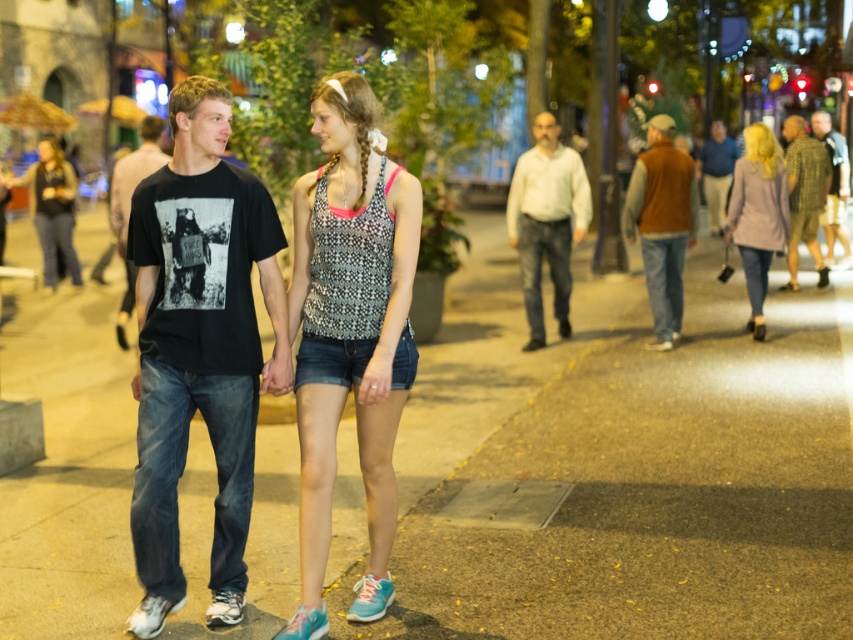
Question: Which object is the farthest from the brown concrete pavement at center?

Choices:
 (A) light gray wool coat at right
 (B) brown suede vest at center
 (C) brown suede vest at right
 (D) matte black tank top at upper left

Answer: (B)

Question: Which point appears closest to the camera in this image?

Choices:
 (A) (154, 442)
 (B) (578, 172)
 (C) (48, 157)

Answer: (A)

Question: Does white cotton shirt at center have a larger size compared to matte black tank top at upper left?

Choices:
 (A) yes
 (B) no

Answer: (B)

Question: Does brown concrete pavement at center have a lesser width compared to brown suede vest at center?

Choices:
 (A) yes
 (B) no

Answer: (B)

Question: Does brown suede vest at right have a smaller size compared to brown suede vest at center?

Choices:
 (A) no
 (B) yes

Answer: (B)

Question: Which object is the closest to the printed fabric tank top at center?

Choices:
 (A) patterned fabric shirt at right
 (B) brown suede vest at center

Answer: (A)